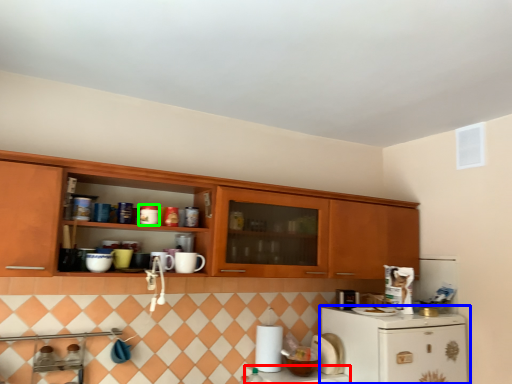
Question: Which is farther away from counter top (highlighted by a red box)? refrigerator (highlighted by a blue box) or appliance (highlighted by a green box)?

Choices:
 (A) refrigerator
 (B) appliance

Answer: (B)